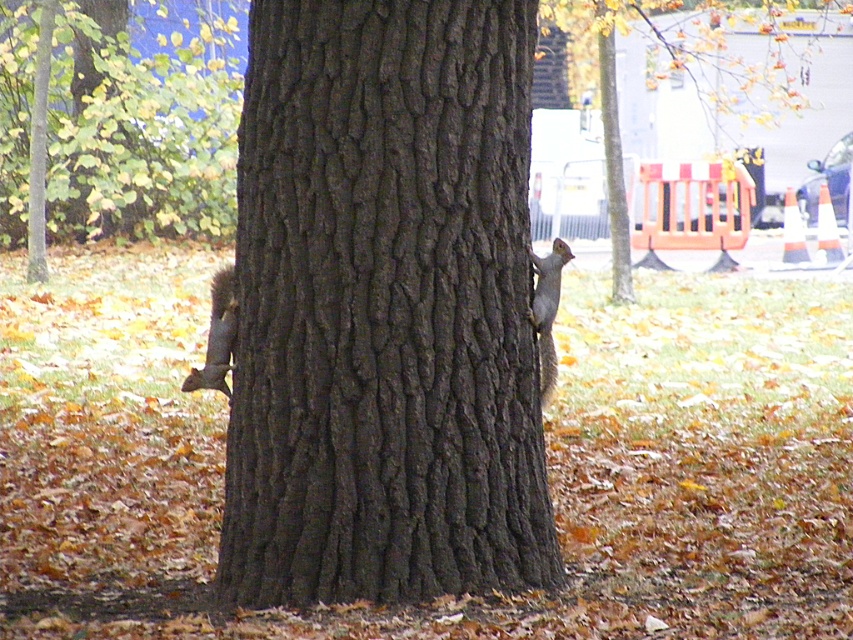
Is gray fur squirrel at left bigger than gray furry squirrel at right?

Yes, gray fur squirrel at left is bigger than gray furry squirrel at right.

Does point (213, 312) come in front of point (540, 397)?

No, it is behind (540, 397).

This screenshot has height=640, width=853. I want to click on gray fur squirrel at left, so click(218, 336).

Looking at this image, is brown rough bark at center wider than gray furry squirrel at right?

Yes, brown rough bark at center is wider than gray furry squirrel at right.

Is brown rough bark at center shorter than gray furry squirrel at right?

Incorrect, brown rough bark at center's height does not fall short of gray furry squirrel at right's.

This screenshot has height=640, width=853. Find the location of `brown rough bark at center`. brown rough bark at center is located at coordinates (384, 308).

Locate an element on the screen. This screenshot has height=640, width=853. brown rough bark at center is located at coordinates (384, 308).

Which is behind, point (341, 593) or point (221, 317)?

The point (221, 317) is more distant.

Does brown rough bark at center appear over gray fur squirrel at left?

Yes.

At what (x,y) coordinates should I click in order to perform the action: click on brown rough bark at center. Please return your answer as a coordinate pair (x, y). Looking at the image, I should click on (384, 308).

Identify the location of brown rough bark at center. Image resolution: width=853 pixels, height=640 pixels. (384, 308).